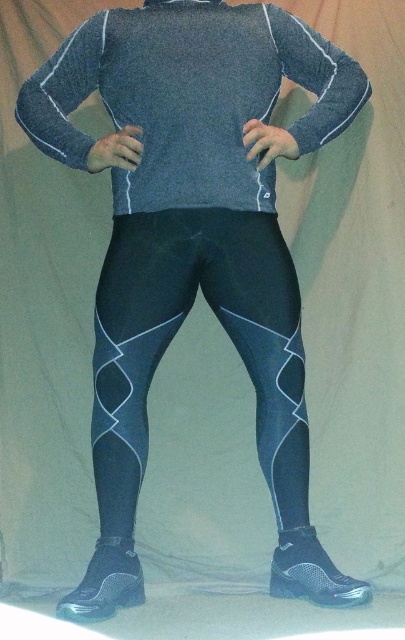
You are a fashion designer looking at a model wearing a matte gray sweater at center and matte black leggings at center. Which piece of clothing is positioned to the left side of the other?

The matte gray sweater at center is positioned on the left side of the matte black leggings at center.

You are a fashion designer trying to create a cohesive outfit. You have a matte gray sweater at center and matte black leggings at center in front of you. Based on their positions in the image, which clothing item should you consider placing higher on the body when designing the outfit?

The matte gray sweater at center is above the matte black leggings at center in the image, so when designing the outfit, the matte gray sweater at center should be placed higher on the body to maintain the visual hierarchy seen in the image.

You are a fashion designer trying to create a coordinated outfit. You have a matte gray sweater at center and matte black leggings at center. Which item should you choose as the focal point if you want the larger piece to stand out more?

The matte gray sweater at center is larger in size than the matte black leggings at center, so you should choose the matte gray sweater at center as the focal point to make the larger piece stand out more.